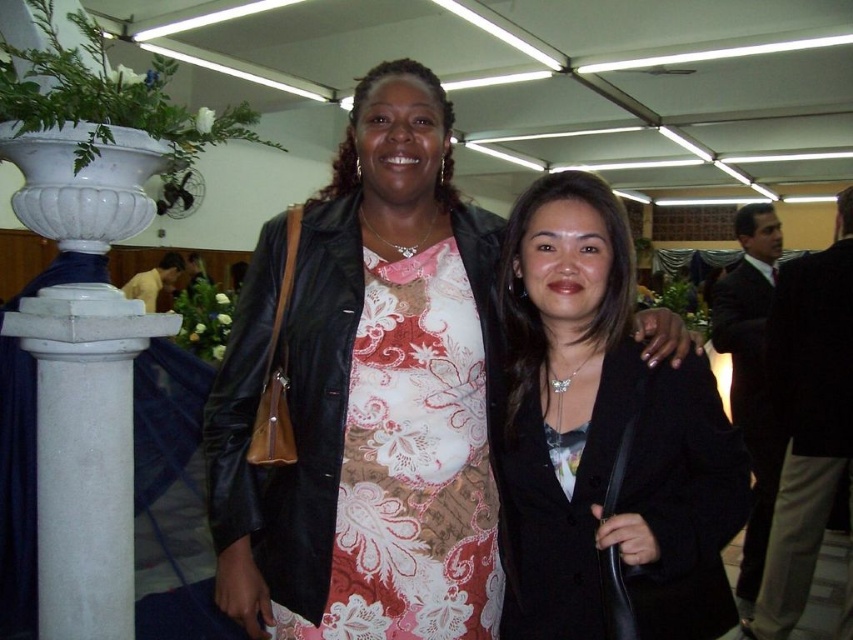
Question: Is floral-patterned fabric dress at center thinner than black suit at right?

Choices:
 (A) no
 (B) yes

Answer: (A)

Question: Can you confirm if matte black leather jacket at center is positioned to the left of black leather jacket at center?

Choices:
 (A) yes
 (B) no

Answer: (A)

Question: Among these points, which one is farthest from the camera?

Choices:
 (A) (770, 211)
 (B) (372, 426)
 (C) (405, 148)
 (D) (567, 452)

Answer: (A)

Question: Among these objects, which one is farthest from the camera?

Choices:
 (A) matte black leather jacket at center
 (B) floral-patterned fabric dress at center

Answer: (B)

Question: Which is nearer to the floral-patterned fabric dress at center?

Choices:
 (A) black leather jacket at center
 (B) matte black leather jacket at center
 (C) black suit at right

Answer: (B)

Question: Can you confirm if matte black leather jacket at center is wider than black leather jacket at center?

Choices:
 (A) no
 (B) yes

Answer: (B)